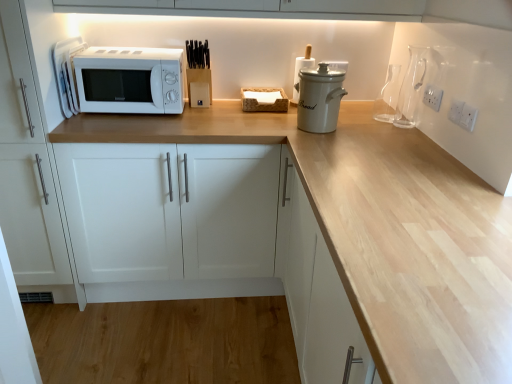
Question: From a real-world perspective, is white plastic electric outlet at upper right, which is the first electric outlet in top-to-bottom order, physically located above or below transparent glass carafe at upper right?

Choices:
 (A) above
 (B) below

Answer: (A)

Question: Considering the positions of point (433, 94) and point (391, 114), is point (433, 94) closer or farther from the camera than point (391, 114)?

Choices:
 (A) farther
 (B) closer

Answer: (B)

Question: Which object is positioned farthest from the transparent glass carafe at upper right, arranged as the 4th appliance when viewed from the left?

Choices:
 (A) white plastic electric outlet at upper right, which is the first electric outlet in top-to-bottom order
 (B) white ceramic crock at center, the 3th appliance positioned from the right
 (C) white plastic electric outlet at upper right, arranged as the second electric outlet when viewed from the back
 (D) white ceramic crock at center, acting as the second appliance starting from the right
 (E) white matte microwave at left

Answer: (E)

Question: Which object is the closest to the white plastic electric outlet at upper right, which appears as the 2th electric outlet when ordered from the bottom?

Choices:
 (A) transparent glass carafe at upper right
 (B) white plastic electric outlet at upper right, the second electric outlet in the top-to-bottom sequence
 (C) white matte microwave at left
 (D) white matte cabinet at left, marked as the first cabinetry in a left-to-right arrangement
 (E) white matte microwave at upper left, which is the fourth appliance from right to left

Answer: (B)